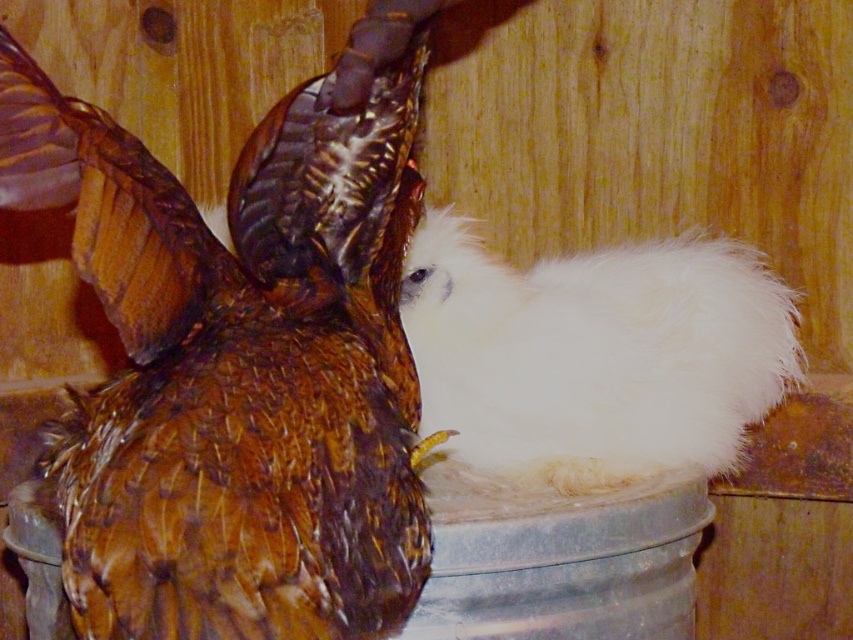
There are two birds in the scene. The brown bird with textured plumage and the white bird on the metallic bucket. If you were standing at the point marked as point (410, 586), which bird would be closer to you?

The distance between the two birds is 3.40 feet. However, without knowing the exact position of point (410, 586) relative to the birds, it is impossible to determine which one is closer. Please provide more information about the location of the point in relation to the birds.

From the picture: You are a farmer checking the coop. There is a brown feathered chicken at upper left and a fluffy white bird on a metallic bucket. Which bird is closer to the entrance located at point [236,369]?

The entrance is located at point [236,369], so the brown feathered chicken at upper left is exactly at the entrance point. Therefore, it is the closest to the entrance.

Based on the coordinates provided in the scene description, where exactly is the brown feathered chicken at upper left located?

The brown feathered chicken at upper left is located at point [236,369].